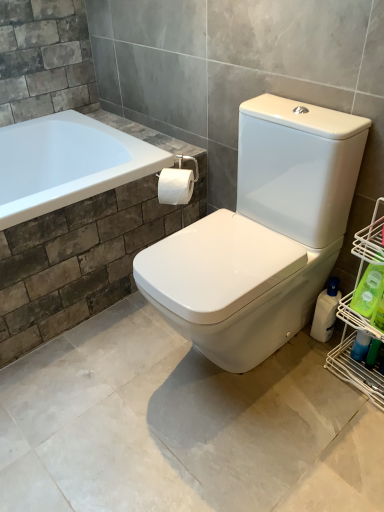
How much space does green plastic bottle at lower right, acting as the first cleaning product starting from the front, occupy vertically?

8.29 inches.

Find the location of a particular element. Image resolution: width=384 pixels, height=512 pixels. white metal shelf at right is located at coordinates (360, 319).

I want to click on blue glossy spray bottle at lower right, which is the second cleaning product from back to front, so click(x=360, y=346).

This screenshot has height=512, width=384. Describe the element at coordinates (360, 346) in the screenshot. I see `blue glossy spray bottle at lower right, which is the second cleaning product from back to front` at that location.

Where is `green plastic bottle at lower right, which is counted as the third cleaning product, starting from the back`? green plastic bottle at lower right, which is counted as the third cleaning product, starting from the back is located at coordinates click(369, 290).

How many degrees apart are the facing directions of white metal shelf at right and green plastic bottle at lower right, acting as the first cleaning product starting from the front?

The angular difference between white metal shelf at right and green plastic bottle at lower right, acting as the first cleaning product starting from the front, is 0.914 degrees.

Which object is more forward, white metal shelf at right or green plastic bottle at lower right, acting as the first cleaning product starting from the front?

white metal shelf at right is in front.

From a real-world perspective, relative to green plastic bottle at lower right, acting as the first cleaning product starting from the front, is white metal shelf at right vertically above or below?

white metal shelf at right is below green plastic bottle at lower right, acting as the first cleaning product starting from the front.

Considering the sizes of objects white metal shelf at right and green plastic bottle at lower right, which is counted as the third cleaning product, starting from the back, in the image provided, who is wider, white metal shelf at right or green plastic bottle at lower right, which is counted as the third cleaning product, starting from the back,?

Wider between the two is white metal shelf at right.

Is white plastic bottle at right, the 3th cleaning product from the front, wider or thinner than blue glossy spray bottle at lower right, which is the second cleaning product from back to front?

white plastic bottle at right, the 3th cleaning product from the front, is wider than blue glossy spray bottle at lower right, which is the second cleaning product from back to front.

Relative to blue glossy spray bottle at lower right, which is the second cleaning product from back to front, is white plastic bottle at right, the 3th cleaning product from the front, in front or behind?

Clearly, white plastic bottle at right, the 3th cleaning product from the front, is behind blue glossy spray bottle at lower right, which is the second cleaning product from back to front.

Considering the relative positions of white plastic bottle at right, the 3th cleaning product from the front, and blue glossy spray bottle at lower right, the second cleaning product in the front-to-back sequence, in the image provided, is white plastic bottle at right, the 3th cleaning product from the front, to the left of blue glossy spray bottle at lower right, the second cleaning product in the front-to-back sequence, from the viewer's perspective?

Yes, white plastic bottle at right, the 3th cleaning product from the front, is to the left of blue glossy spray bottle at lower right, the second cleaning product in the front-to-back sequence.

Can you confirm if white plastic bottle at right, which is the first cleaning product in back-to-front order, is taller than blue glossy spray bottle at lower right, which is the second cleaning product from back to front?

Indeed, white plastic bottle at right, which is the first cleaning product in back-to-front order, has a greater height compared to blue glossy spray bottle at lower right, which is the second cleaning product from back to front.

The image size is (384, 512). Identify the location of cleaning product above the white plastic bottle at right, which is the first cleaning product in back-to-front order (from the image's perspective). (369, 290).

Is white plastic bottle at right, which is the first cleaning product in back-to-front order, oriented towards green plastic bottle at lower right, which is counted as the third cleaning product, starting from the back?

No, white plastic bottle at right, which is the first cleaning product in back-to-front order, is not oriented towards green plastic bottle at lower right, which is counted as the third cleaning product, starting from the back.

Is white plastic bottle at right, which is the first cleaning product in back-to-front order, not within green plastic bottle at lower right, which is counted as the third cleaning product, starting from the back?

Indeed, white plastic bottle at right, which is the first cleaning product in back-to-front order, is completely outside green plastic bottle at lower right, which is counted as the third cleaning product, starting from the back.

From the picture: From a real-world perspective, which is physically below, white metal shelf at right or white matte toilet paper at center?

From a 3D spatial view, white metal shelf at right is below.

Is white matte toilet paper at center surrounded by white metal shelf at right?

No, white metal shelf at right does not contain white matte toilet paper at center.

Is white metal shelf at right far away from white matte toilet paper at center?

Actually, white metal shelf at right and white matte toilet paper at center are a little close together.

Is white matte toilet paper at center at the back of white metal shelf at right?

That's not correct — white metal shelf at right is not looking away from white matte toilet paper at center.

Is white plastic bottle at right, the 3th cleaning product from the front, positioned with its back to white matte toilet paper at center?

No, white plastic bottle at right, the 3th cleaning product from the front, is not facing the opposite direction of white matte toilet paper at center.

At what (x,y) coordinates should I click in order to perform the action: click on toilet paper that is above the white plastic bottle at right, the 3th cleaning product from the front (from the image's perspective). Please return your answer as a coordinate pair (x, y). This screenshot has width=384, height=512. Looking at the image, I should click on (175, 186).

Is white plastic bottle at right, which is the first cleaning product in back-to-front order, positioned in front of white matte toilet paper at center?

Yes, the depth of white plastic bottle at right, which is the first cleaning product in back-to-front order, is less than that of white matte toilet paper at center.

From a real-world perspective, who is located lower, white plastic bottle at right, the 3th cleaning product from the front, or white matte toilet paper at center?

In real-world perspective, white plastic bottle at right, the 3th cleaning product from the front, is lower.

Is white matte toilet paper at center positioned with its back to green plastic bottle at lower right, acting as the first cleaning product starting from the front?

No, white matte toilet paper at center is not facing away from green plastic bottle at lower right, acting as the first cleaning product starting from the front.

Is white matte toilet paper at center at the left side of green plastic bottle at lower right, which is counted as the third cleaning product, starting from the back?

Yes.

Considering the sizes of white matte toilet paper at center and green plastic bottle at lower right, which is counted as the third cleaning product, starting from the back, in the image, is white matte toilet paper at center wider or thinner than green plastic bottle at lower right, which is counted as the third cleaning product, starting from the back,?

Considering their sizes, white matte toilet paper at center looks broader than green plastic bottle at lower right, which is counted as the third cleaning product, starting from the back.

From the image's perspective, is green plastic bottle at lower right, which is counted as the third cleaning product, starting from the back, located above white metal shelf at right?

Yes, from the image's perspective, green plastic bottle at lower right, which is counted as the third cleaning product, starting from the back, is over white metal shelf at right.

Measure the distance from green plastic bottle at lower right, acting as the first cleaning product starting from the front, to white metal shelf at right.

green plastic bottle at lower right, acting as the first cleaning product starting from the front, and white metal shelf at right are 4.93 inches apart.

Is green plastic bottle at lower right, acting as the first cleaning product starting from the front, oriented away from white metal shelf at right?

Absolutely, green plastic bottle at lower right, acting as the first cleaning product starting from the front, is directed away from white metal shelf at right.

Which object is positioned more to the left, green plastic bottle at lower right, acting as the first cleaning product starting from the front, or white metal shelf at right?

Positioned to the left is green plastic bottle at lower right, acting as the first cleaning product starting from the front.

Find the location of `shelf located underneath the green plastic bottle at lower right, acting as the first cleaning product starting from the front (from a real-world perspective)`. shelf located underneath the green plastic bottle at lower right, acting as the first cleaning product starting from the front (from a real-world perspective) is located at coordinates (360, 319).

In order to click on the 1st cleaning product above the blue glossy spray bottle at lower right, which is the second cleaning product from back to front (from the image's perspective) in this screenshot , I will do `click(326, 311)`.

From the picture: Which object lies further to the anchor point blue glossy spray bottle at lower right, which is the second cleaning product from back to front, white matte toilet paper at center or green plastic bottle at lower right, which is counted as the third cleaning product, starting from the back?

Based on the image, white matte toilet paper at center appears to be further to blue glossy spray bottle at lower right, which is the second cleaning product from back to front.

From the image, which object appears to be nearer to blue glossy spray bottle at lower right, the second cleaning product in the front-to-back sequence, white plastic bottle at right, which is the first cleaning product in back-to-front order, or white matte toilet paper at center?

white plastic bottle at right, which is the first cleaning product in back-to-front order.

Considering their positions, is green plastic bottle at lower right, which is counted as the third cleaning product, starting from the back, positioned closer to white metal shelf at right than white matte toilet paper at center?

green plastic bottle at lower right, which is counted as the third cleaning product, starting from the back, is positioned closer to the anchor white metal shelf at right.

Looking at the image, which one is located closer to white plastic bottle at right, which is the first cleaning product in back-to-front order, white matte toilet paper at center or white metal shelf at right?

Based on the image, white metal shelf at right appears to be nearer to white plastic bottle at right, which is the first cleaning product in back-to-front order.

Based on their spatial positions, is white metal shelf at right or white matte toilet paper at center further from green plastic bottle at lower right, which is counted as the third cleaning product, starting from the back?

Among the two, white matte toilet paper at center is located further to green plastic bottle at lower right, which is counted as the third cleaning product, starting from the back.

When comparing their distances from blue glossy spray bottle at lower right, the second cleaning product in the front-to-back sequence, does white metal shelf at right or green plastic bottle at lower right, acting as the first cleaning product starting from the front, seem further?

green plastic bottle at lower right, acting as the first cleaning product starting from the front, lies further to blue glossy spray bottle at lower right, the second cleaning product in the front-to-back sequence, than the other object.

Looking at the image, which one is located closer to white matte toilet paper at center, blue glossy spray bottle at lower right, the second cleaning product in the front-to-back sequence, or green plastic bottle at lower right, which is counted as the third cleaning product, starting from the back?

green plastic bottle at lower right, which is counted as the third cleaning product, starting from the back.

Which object lies nearer to the anchor point green plastic bottle at lower right, acting as the first cleaning product starting from the front, white matte toilet paper at center or white plastic bottle at right, which is the first cleaning product in back-to-front order?

white plastic bottle at right, which is the first cleaning product in back-to-front order, is closer to green plastic bottle at lower right, acting as the first cleaning product starting from the front.

The height and width of the screenshot is (512, 384). In order to click on cleaning product between white matte toilet paper at center and green plastic bottle at lower right, acting as the first cleaning product starting from the front, in the horizontal direction in this screenshot , I will do `click(326, 311)`.

The width and height of the screenshot is (384, 512). Find the location of `cleaning product positioned between white metal shelf at right and blue glossy spray bottle at lower right, the second cleaning product in the front-to-back sequence, from near to far`. cleaning product positioned between white metal shelf at right and blue glossy spray bottle at lower right, the second cleaning product in the front-to-back sequence, from near to far is located at coordinates (369, 290).

Where is `cleaning product between green plastic bottle at lower right, acting as the first cleaning product starting from the front, and white plastic bottle at right, which is the first cleaning product in back-to-front order, from front to back`? cleaning product between green plastic bottle at lower right, acting as the first cleaning product starting from the front, and white plastic bottle at right, which is the first cleaning product in back-to-front order, from front to back is located at coordinates (360, 346).